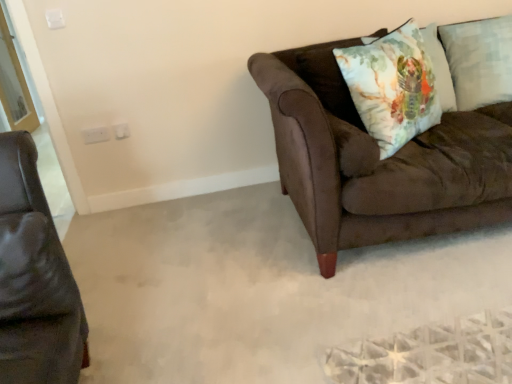
Question: Is floral cotton cushion at upper right, which is the first pillow in left-to-right order, taller than matte black leather couch at left, which is counted as the first studio couch, starting from the front?

Choices:
 (A) no
 (B) yes

Answer: (B)

Question: Could you tell me if floral cotton cushion at upper right, placed as the second pillow when sorted from right to left, is facing matte black leather couch at left, which appears as the 2th studio couch when viewed from the back?

Choices:
 (A) no
 (B) yes

Answer: (A)

Question: Considering the relative sizes of floral cotton cushion at upper right, placed as the second pillow when sorted from right to left, and matte black leather couch at left, which is counted as the first studio couch, starting from the front, in the image provided, is floral cotton cushion at upper right, placed as the second pillow when sorted from right to left, smaller than matte black leather couch at left, which is counted as the first studio couch, starting from the front,?

Choices:
 (A) yes
 (B) no

Answer: (B)

Question: Is floral cotton cushion at upper right, placed as the second pillow when sorted from right to left, positioned with its back to matte black leather couch at left, marked as the second studio couch in a right-to-left arrangement?

Choices:
 (A) no
 (B) yes

Answer: (A)

Question: Can you confirm if floral cotton cushion at upper right, placed as the second pillow when sorted from right to left, is positioned to the left of matte black leather couch at left, which appears as the 2th studio couch when viewed from the back?

Choices:
 (A) yes
 (B) no

Answer: (B)

Question: Does floral cotton cushion at upper right, which is the first pillow in left-to-right order, come behind matte black leather couch at left, which is counted as the first studio couch, starting from the front?

Choices:
 (A) yes
 (B) no

Answer: (A)

Question: From the image's perspective, is brown leather armchair at left above light blue textured pillow at upper right, the first pillow positioned from the right?

Choices:
 (A) no
 (B) yes

Answer: (A)

Question: Is brown leather armchair at left further to the viewer compared to light blue textured pillow at upper right, the first pillow positioned from the right?

Choices:
 (A) no
 (B) yes

Answer: (A)

Question: Is brown leather armchair at left taller than light blue textured pillow at upper right, which is the second pillow from left to right?

Choices:
 (A) no
 (B) yes

Answer: (A)

Question: Considering the relative sizes of brown leather armchair at left and light blue textured pillow at upper right, the first pillow positioned from the right, in the image provided, is brown leather armchair at left wider than light blue textured pillow at upper right, the first pillow positioned from the right,?

Choices:
 (A) no
 (B) yes

Answer: (B)

Question: Does brown leather armchair at left lie in front of light blue textured pillow at upper right, the first pillow positioned from the right?

Choices:
 (A) yes
 (B) no

Answer: (A)

Question: Does brown leather armchair at left have a lesser width compared to light blue textured pillow at upper right, which is the second pillow from left to right?

Choices:
 (A) yes
 (B) no

Answer: (B)

Question: From the image's perspective, would you say brown leather armchair at left is shown under watercolor fabric pillow at upper right?

Choices:
 (A) yes
 (B) no

Answer: (A)